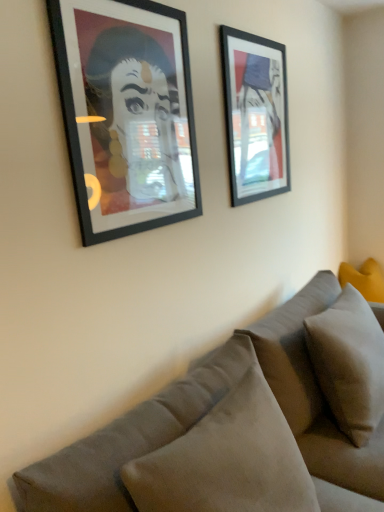
Measure the distance between suede-like beige pillow at lower right, which ranks as the first pillow in front-to-back order, and camera.

A distance of 37.09 inches exists between suede-like beige pillow at lower right, which ranks as the first pillow in front-to-back order, and camera.

Describe the element at coordinates (364, 279) in the screenshot. The height and width of the screenshot is (512, 384). I see `yellow fabric pillow at right, which is counted as the third pillow, starting from the left` at that location.

Looking at this image, how much space does matte black picture frame at upper right, acting as the first picture frame starting from the right, occupy vertically?

matte black picture frame at upper right, acting as the first picture frame starting from the right, is 31.53 inches tall.

This screenshot has width=384, height=512. What do you see at coordinates (349, 362) in the screenshot? I see `light gray fabric pillow at lower right, acting as the second pillow starting from the left` at bounding box center [349, 362].

What is the approximate width of matte black picture frame at left, the 2th picture frame from the back?

The width of matte black picture frame at left, the 2th picture frame from the back, is 1.27 inches.

Locate an element on the screen. This screenshot has height=512, width=384. velvet gray couch at lower right is located at coordinates (244, 424).

Where is `suede-like beige pillow at lower right, which ranks as the first pillow in front-to-back order`? This screenshot has height=512, width=384. suede-like beige pillow at lower right, which ranks as the first pillow in front-to-back order is located at coordinates (228, 459).

Which object is further away from the camera taking this photo, matte black picture frame at left, the 2th picture frame from the back, or matte black picture frame at upper right, acting as the first picture frame starting from the right?

matte black picture frame at upper right, acting as the first picture frame starting from the right, is behind.

Is matte black picture frame at left, the 1th picture frame when ordered from left to right, bigger or smaller than matte black picture frame at upper right, the second picture frame when ordered from left to right?

Clearly, matte black picture frame at left, the 1th picture frame when ordered from left to right, is larger in size than matte black picture frame at upper right, the second picture frame when ordered from left to right.

Which object is positioned more to the left, matte black picture frame at left, the first picture frame viewed from the front, or matte black picture frame at upper right, placed as the second picture frame when sorted from front to back?

matte black picture frame at left, the first picture frame viewed from the front.

From a real-world perspective, is matte black picture frame at left, the 1th picture frame when ordered from left to right, positioned above or below matte black picture frame at upper right, the second picture frame when ordered from left to right?

matte black picture frame at left, the 1th picture frame when ordered from left to right, is below matte black picture frame at upper right, the second picture frame when ordered from left to right.

Would you consider yellow fabric pillow at right, which is counted as the third pillow, starting from the left, to be distant from matte black picture frame at left, the first picture frame viewed from the front?

Yes.

Is yellow fabric pillow at right, arranged as the 1th pillow when viewed from the right, turned away from matte black picture frame at left, the first picture frame viewed from the front?

No, yellow fabric pillow at right, arranged as the 1th pillow when viewed from the right,'s orientation is not away from matte black picture frame at left, the first picture frame viewed from the front.

Is yellow fabric pillow at right, which is counted as the third pillow, starting from the left, at the right side of matte black picture frame at left, the 2th picture frame from the back?

Yes.

Between velvet gray couch at lower right and light gray fabric pillow at lower right, acting as the second pillow starting from the left, which one has smaller size?

light gray fabric pillow at lower right, acting as the second pillow starting from the left.

Is velvet gray couch at lower right thinner than light gray fabric pillow at lower right, arranged as the second pillow when viewed from the back?

No.

Considering the positions of objects velvet gray couch at lower right and light gray fabric pillow at lower right, which is counted as the 2th pillow, starting from the right, in the image provided, who is more to the right, velvet gray couch at lower right or light gray fabric pillow at lower right, which is counted as the 2th pillow, starting from the right,?

light gray fabric pillow at lower right, which is counted as the 2th pillow, starting from the right.

How much distance is there between velvet gray couch at lower right and light gray fabric pillow at lower right, which is counted as the 2th pillow, starting from the right?

velvet gray couch at lower right and light gray fabric pillow at lower right, which is counted as the 2th pillow, starting from the right, are 7.49 inches apart.

How different are the orientations of light gray fabric pillow at lower right, the second pillow from the front, and suede-like beige pillow at lower right, arranged as the first pillow when viewed from the left, in degrees?

0.000351 degrees separate the facing orientations of light gray fabric pillow at lower right, the second pillow from the front, and suede-like beige pillow at lower right, arranged as the first pillow when viewed from the left.

Does point (351, 422) appear closer or farther from the camera than point (284, 476)?

Point (351, 422) is positioned farther from the camera compared to point (284, 476).

From a real-world perspective, is light gray fabric pillow at lower right, which is counted as the 2th pillow, starting from the right, above or below suede-like beige pillow at lower right, arranged as the first pillow when viewed from the left?

In terms of real-world spatial position, light gray fabric pillow at lower right, which is counted as the 2th pillow, starting from the right, is below suede-like beige pillow at lower right, arranged as the first pillow when viewed from the left.

Considering the relative sizes of light gray fabric pillow at lower right, which is counted as the 2th pillow, starting from the right, and suede-like beige pillow at lower right, which appears as the third pillow when viewed from the back, in the image provided, is light gray fabric pillow at lower right, which is counted as the 2th pillow, starting from the right, bigger than suede-like beige pillow at lower right, which appears as the third pillow when viewed from the back,?

Indeed, light gray fabric pillow at lower right, which is counted as the 2th pillow, starting from the right, has a larger size compared to suede-like beige pillow at lower right, which appears as the third pillow when viewed from the back.

Consider the image. Which of these two, matte black picture frame at left, acting as the 2th picture frame starting from the right, or suede-like beige pillow at lower right, which is counted as the third pillow, starting from the right, is wider?

Wider between the two is suede-like beige pillow at lower right, which is counted as the third pillow, starting from the right.

Who is shorter, matte black picture frame at left, the 1th picture frame when ordered from left to right, or suede-like beige pillow at lower right, which appears as the third pillow when viewed from the back?

Standing shorter between the two is suede-like beige pillow at lower right, which appears as the third pillow when viewed from the back.

From a real-world perspective, between matte black picture frame at left, the 2th picture frame from the back, and suede-like beige pillow at lower right, which ranks as the first pillow in front-to-back order, who is vertically lower?

suede-like beige pillow at lower right, which ranks as the first pillow in front-to-back order.

Considering the sizes of objects matte black picture frame at left, the 1th picture frame when ordered from left to right, and suede-like beige pillow at lower right, which appears as the third pillow when viewed from the back, in the image provided, who is smaller, matte black picture frame at left, the 1th picture frame when ordered from left to right, or suede-like beige pillow at lower right, which appears as the third pillow when viewed from the back,?

Smaller between the two is matte black picture frame at left, the 1th picture frame when ordered from left to right.

Would you say light gray fabric pillow at lower right, which is counted as the 2th pillow, starting from the right, is to the left or to the right of yellow fabric pillow at right, the first pillow when ordered from back to front, in the picture?

light gray fabric pillow at lower right, which is counted as the 2th pillow, starting from the right, is positioned on yellow fabric pillow at right, the first pillow when ordered from back to front,'s left side.

How different are the orientations of light gray fabric pillow at lower right, the second pillow from the front, and yellow fabric pillow at right, placed as the third pillow when sorted from front to back, in degrees?

They differ by 89.9 degrees in their facing directions.

Is point (351, 367) closer to viewer compared to point (348, 270)?

Yes, it is in front of point (348, 270).

Is light gray fabric pillow at lower right, which is counted as the 2th pillow, starting from the right, oriented away from yellow fabric pillow at right, which is counted as the third pillow, starting from the left?

No, yellow fabric pillow at right, which is counted as the third pillow, starting from the left, is not at the back of light gray fabric pillow at lower right, which is counted as the 2th pillow, starting from the right.

Considering the sizes of objects velvet gray couch at lower right and suede-like beige pillow at lower right, which ranks as the first pillow in front-to-back order, in the image provided, who is wider, velvet gray couch at lower right or suede-like beige pillow at lower right, which ranks as the first pillow in front-to-back order,?

Wider between the two is velvet gray couch at lower right.

Is velvet gray couch at lower right behind suede-like beige pillow at lower right, which ranks as the first pillow in front-to-back order?

No, velvet gray couch at lower right is closer to the camera.

From a real-world perspective, is velvet gray couch at lower right above or below suede-like beige pillow at lower right, arranged as the first pillow when viewed from the left?

velvet gray couch at lower right is situated lower than suede-like beige pillow at lower right, arranged as the first pillow when viewed from the left, in the real world.

The image size is (384, 512). I want to click on picture frame on the left of matte black picture frame at upper right, acting as the first picture frame starting from the right, so click(127, 115).

The height and width of the screenshot is (512, 384). What are the coordinates of `the 1st picture frame above the yellow fabric pillow at right, the first pillow when ordered from back to front (from a real-world perspective)` in the screenshot? It's located at (127, 115).

Based on their spatial positions, is suede-like beige pillow at lower right, which appears as the third pillow when viewed from the back, or matte black picture frame at left, the 2th picture frame from the back, closer to light gray fabric pillow at lower right, the second pillow from the front?

suede-like beige pillow at lower right, which appears as the third pillow when viewed from the back, is positioned closer to the anchor light gray fabric pillow at lower right, the second pillow from the front.

Based on their spatial positions, is matte black picture frame at upper right, the second picture frame when ordered from left to right, or velvet gray couch at lower right further from matte black picture frame at left, the 2th picture frame from the back?

The object further to matte black picture frame at left, the 2th picture frame from the back, is velvet gray couch at lower right.

Considering their positions, is velvet gray couch at lower right positioned closer to light gray fabric pillow at lower right, acting as the second pillow starting from the left, than matte black picture frame at left, the 1th picture frame when ordered from left to right?

Based on the image, velvet gray couch at lower right appears to be nearer to light gray fabric pillow at lower right, acting as the second pillow starting from the left.

Considering their positions, is light gray fabric pillow at lower right, arranged as the second pillow when viewed from the back, positioned closer to velvet gray couch at lower right than yellow fabric pillow at right, placed as the third pillow when sorted from front to back?

light gray fabric pillow at lower right, arranged as the second pillow when viewed from the back, lies closer to velvet gray couch at lower right than the other object.

Looking at the image, which one is located closer to suede-like beige pillow at lower right, which ranks as the first pillow in front-to-back order, matte black picture frame at left, acting as the 2th picture frame starting from the right, or matte black picture frame at upper right, placed as the second picture frame when sorted from front to back?

Among the two, matte black picture frame at left, acting as the 2th picture frame starting from the right, is located nearer to suede-like beige pillow at lower right, which ranks as the first pillow in front-to-back order.

Based on their spatial positions, is suede-like beige pillow at lower right, which appears as the third pillow when viewed from the back, or matte black picture frame at upper right, the first picture frame from the back, closer to yellow fabric pillow at right, which is counted as the third pillow, starting from the left?

Based on the image, matte black picture frame at upper right, the first picture frame from the back, appears to be nearer to yellow fabric pillow at right, which is counted as the third pillow, starting from the left.

Estimate the real-world distances between objects in this image. Which object is further from light gray fabric pillow at lower right, which is counted as the 2th pillow, starting from the right, suede-like beige pillow at lower right, which is counted as the third pillow, starting from the right, or yellow fabric pillow at right, arranged as the 1th pillow when viewed from the right?

The object further to light gray fabric pillow at lower right, which is counted as the 2th pillow, starting from the right, is yellow fabric pillow at right, arranged as the 1th pillow when viewed from the right.

When comparing their distances from yellow fabric pillow at right, which is counted as the third pillow, starting from the left, does matte black picture frame at left, the 2th picture frame from the back, or matte black picture frame at upper right, placed as the second picture frame when sorted from front to back, seem closer?

Among the two, matte black picture frame at upper right, placed as the second picture frame when sorted from front to back, is located nearer to yellow fabric pillow at right, which is counted as the third pillow, starting from the left.

This screenshot has height=512, width=384. Identify the location of picture frame between matte black picture frame at upper right, acting as the first picture frame starting from the right, and velvet gray couch at lower right from top to bottom. (127, 115).

The height and width of the screenshot is (512, 384). I want to click on pillow between matte black picture frame at left, the 1th picture frame when ordered from left to right, and yellow fabric pillow at right, which is counted as the third pillow, starting from the left, in the front-back direction, so click(349, 362).

Where is `pillow between velvet gray couch at lower right and light gray fabric pillow at lower right, which is counted as the 2th pillow, starting from the right, in the front-back direction`? Image resolution: width=384 pixels, height=512 pixels. pillow between velvet gray couch at lower right and light gray fabric pillow at lower right, which is counted as the 2th pillow, starting from the right, in the front-back direction is located at coordinates (228, 459).

I want to click on picture frame between light gray fabric pillow at lower right, acting as the second pillow starting from the left, and yellow fabric pillow at right, arranged as the 1th pillow when viewed from the right, in the front-back direction, so click(x=255, y=115).